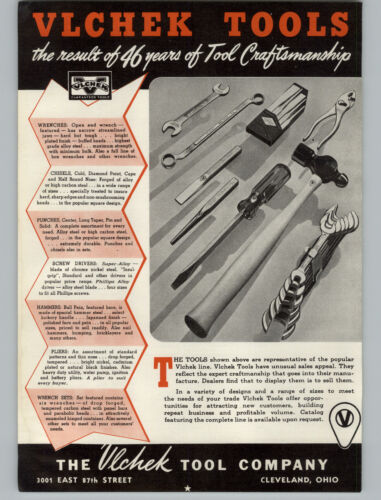
The image size is (381, 500). Identify the location of vintage tool  poster. (145, 392).